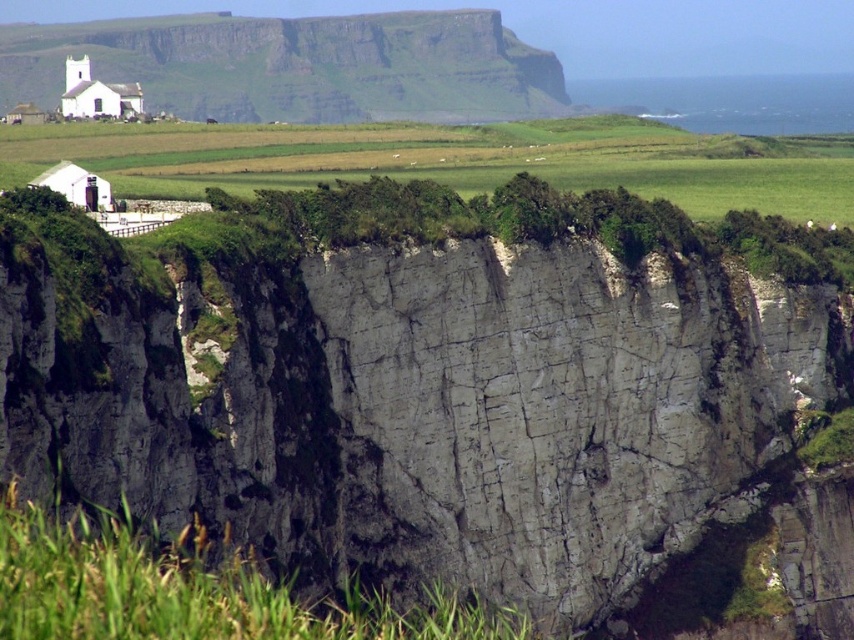
Question: Does gray rough cliff at center have a smaller size compared to white stone cliff at upper left?

Choices:
 (A) no
 (B) yes

Answer: (A)

Question: Which point is farther from the camera taking this photo?

Choices:
 (A) [x=542, y=108]
 (B) [x=519, y=182]

Answer: (A)

Question: Which point appears closest to the camera in this image?

Choices:
 (A) (281, 467)
 (B) (127, 60)

Answer: (A)

Question: Is gray rough cliff at center wider than white stone cliff at upper left?

Choices:
 (A) no
 (B) yes

Answer: (A)

Question: Which point is farther to the camera?

Choices:
 (A) (443, 96)
 (B) (344, 477)

Answer: (A)

Question: Is gray rough cliff at center thinner than white stone cliff at upper left?

Choices:
 (A) no
 (B) yes

Answer: (B)